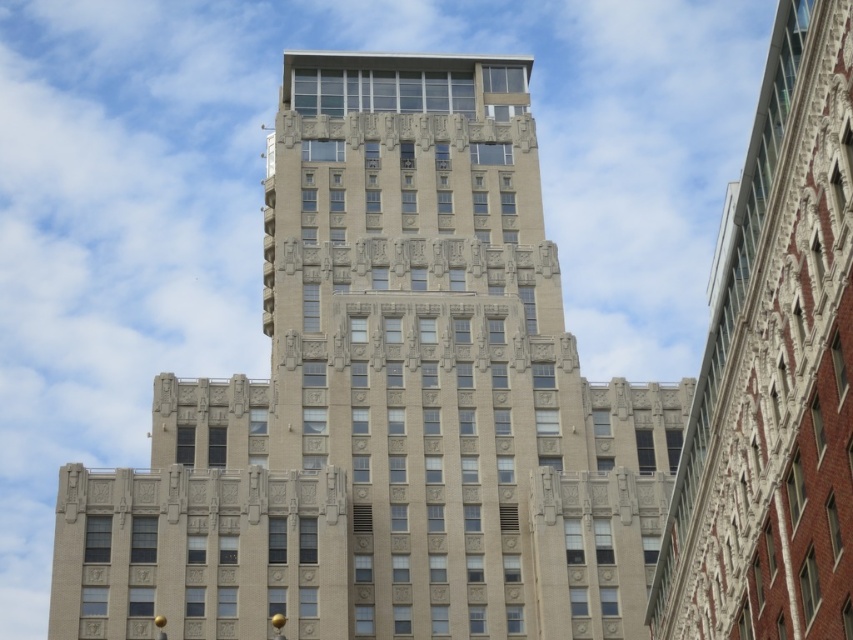
Question: Which point appears farthest from the camera in this image?

Choices:
 (A) (846, 392)
 (B) (161, 563)

Answer: (B)

Question: Is the position of beige stone building at center less distant than that of beige stone building at upper center?

Choices:
 (A) no
 (B) yes

Answer: (A)

Question: Which object is closer to the camera taking this photo?

Choices:
 (A) beige stone building at upper center
 (B) beige stone building at center

Answer: (A)

Question: Does beige stone building at center appear under beige stone building at upper center?

Choices:
 (A) yes
 (B) no

Answer: (B)

Question: Does beige stone building at center appear on the left side of beige stone building at upper center?

Choices:
 (A) yes
 (B) no

Answer: (A)